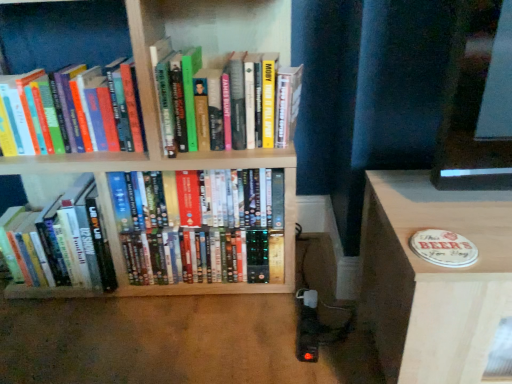
Question: Considering the positions of wooden bookshelf at center and hardcover books at center, the 2th book in the right-to-left sequence, in the image, is wooden bookshelf at center wider or thinner than hardcover books at center, the 2th book in the right-to-left sequence,?

Choices:
 (A) thin
 (B) wide

Answer: (B)

Question: Is wooden bookshelf at center in front of or behind hardcover books at center, arranged as the 3th book when viewed from the left, in the image?

Choices:
 (A) behind
 (B) front

Answer: (B)

Question: Which object is positioned farthest from the hardcover books at center, acting as the fourth book starting from the left?

Choices:
 (A) hardcover book at upper left, the second book positioned from the left
 (B) wooden bookshelf at center
 (C) wooden coaster at lower right
 (D) hardcover books at center, the 2th book in the right-to-left sequence
 (E) hardcover books at left, acting as the 4th book starting from the right

Answer: (C)

Question: Based on their relative distances, which object is nearer to the hardcover books at left, the first book viewed from the left?

Choices:
 (A) hardcover books at center, acting as the fourth book starting from the left
 (B) wooden bookshelf at center
 (C) hardcover books at center, the 2th book in the right-to-left sequence
 (D) wooden coaster at lower right
 (E) hardcover book at upper left, the third book in the right-to-left sequence

Answer: (B)